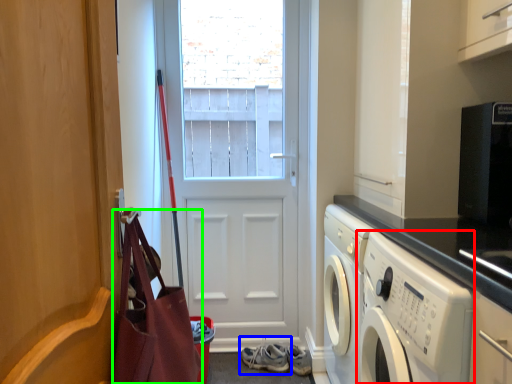
Question: Considering the real-world distances, which object is farthest from washing machine (highlighted by a red box)? footwear (highlighted by a blue box) or bag (highlighted by a green box)?

Choices:
 (A) footwear
 (B) bag

Answer: (A)